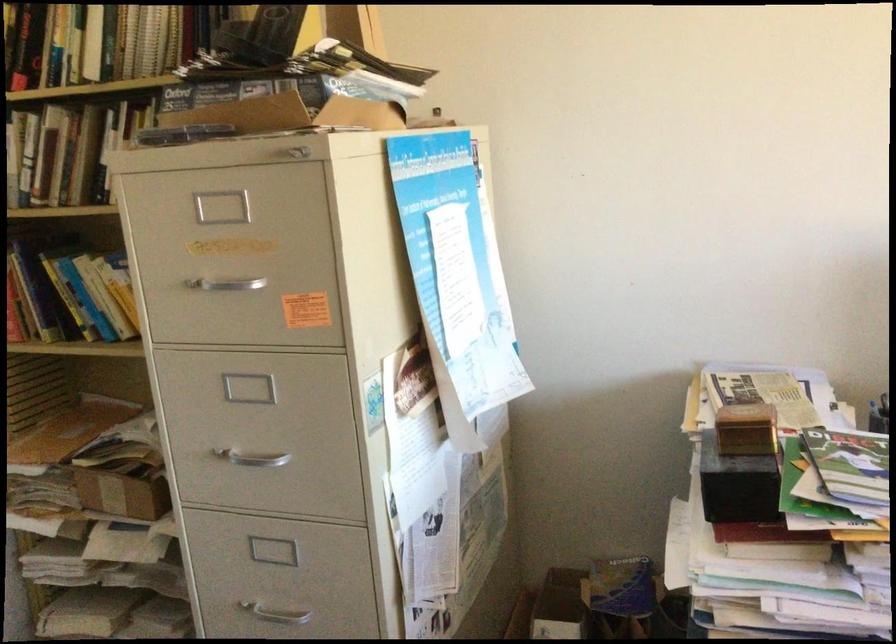
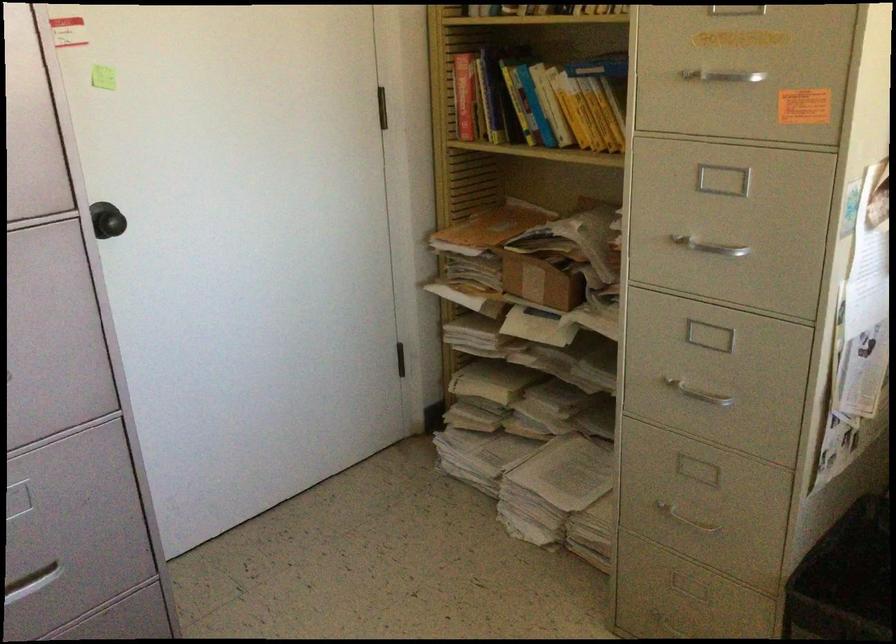
Find the pixel in the second image that matches [117,494] in the first image.

(539, 281)